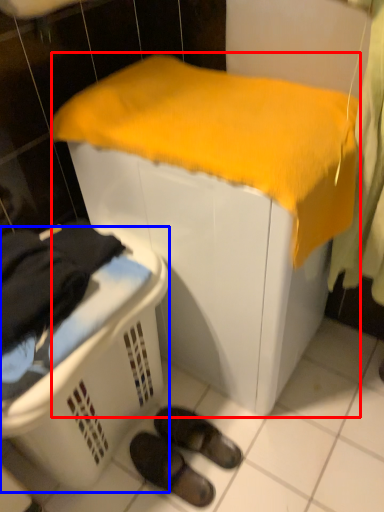
Question: Which of the following is the farthest to the observer, furniture (highlighted by a red box) or laundry basket (highlighted by a blue box)?

Choices:
 (A) furniture
 (B) laundry basket

Answer: (A)